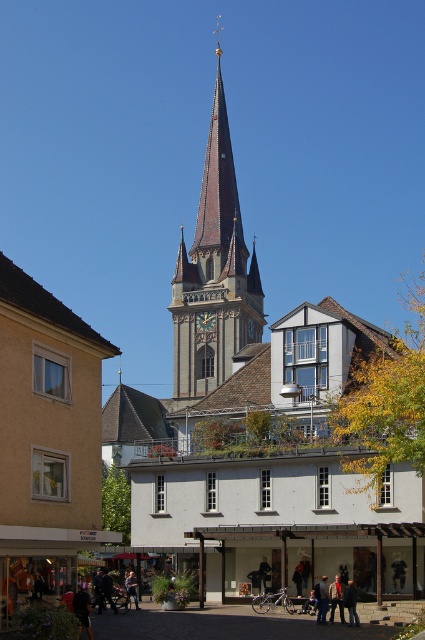
Describe the element at coordinates (255, 426) in the screenshot. I see `brown stone church at center` at that location.

Is point (411, 458) less distant than point (340, 592)?

That is True.

Where is `brown stone church at center`? brown stone church at center is located at coordinates (255, 426).

Is brown stone church at center shorter than gold textured clock at center?

No.

What are the coordinates of `brown stone church at center` in the screenshot? It's located at (255, 426).

Which is in front, point (210, 596) or point (215, 314)?

Point (210, 596) is in front.

Where is `brown stone church at center`? This screenshot has width=425, height=640. brown stone church at center is located at coordinates (255, 426).

Does dark brown leather jacket at center appear on the right side of dark blue jeans at center?

Correct, you'll find dark brown leather jacket at center to the right of dark blue jeans at center.

Who is positioned more to the left, dark brown leather jacket at center or dark blue jeans at center?

dark blue jeans at center is more to the left.

Is point (320, 612) behind point (130, 582)?

That is False.

Image resolution: width=425 pixels, height=640 pixels. In order to click on dark brown leather jacket at center in this screenshot , I will do `click(322, 598)`.